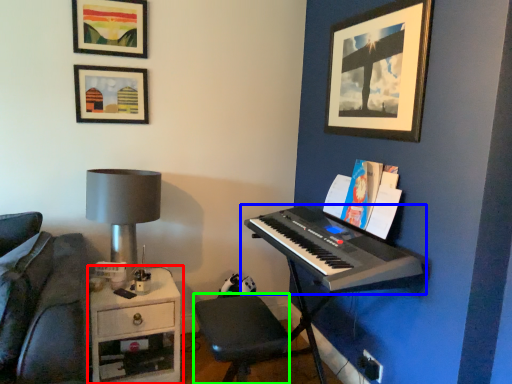
Question: Which is nearer to the table (highlighted by a red box)? musical keyboard (highlighted by a blue box) or step stool (highlighted by a green box).

Choices:
 (A) musical keyboard
 (B) step stool

Answer: (B)